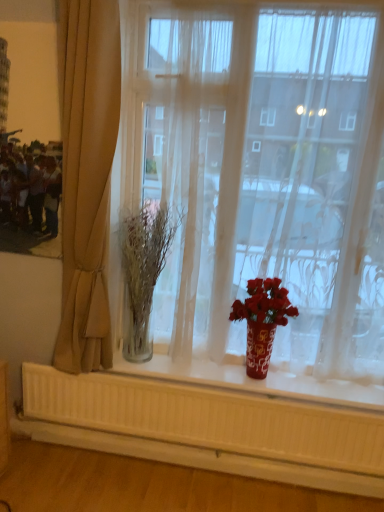
What do you see at coordinates (262, 321) in the screenshot?
I see `shiny red vase at center` at bounding box center [262, 321].

The width and height of the screenshot is (384, 512). Describe the element at coordinates (87, 176) in the screenshot. I see `beige fabric curtain at left` at that location.

I want to click on shiny red vase at center, so tap(262, 321).

Which is closer to the camera, (86,110) or (262,291)?

Point (86,110)

In terms of height, does beige fabric curtain at left look taller or shorter compared to shiny red vase at center?

In the image, beige fabric curtain at left appears to be taller than shiny red vase at center.

Find the location of a particular element. This screenshot has width=384, height=512. houseplant behind the beige fabric curtain at left is located at coordinates (262, 321).

Is transparent glass vase at center closer to the viewer compared to shiny red vase at center?

Yes, it is in front of shiny red vase at center.

Which is more to the right, transparent glass vase at center or shiny red vase at center?

transparent glass vase at center.

From the picture: Is transparent glass vase at center positioned with its back to shiny red vase at center?

Yes, transparent glass vase at center is positioned with its back facing shiny red vase at center.

Find the location of a particular element. This screenshot has width=384, height=512. window above the shiny red vase at center (from the image's perspective) is located at coordinates coord(261,186).

Is clear glass vase at center taller than shiny red vase at center?

Correct, clear glass vase at center is much taller as shiny red vase at center.

Based on the photo, is clear glass vase at center surrounding shiny red vase at center?

No, shiny red vase at center is not surrounded by clear glass vase at center.

Is shiny red vase at center at the back of clear glass vase at center?

clear glass vase at center is not turned away from shiny red vase at center.

Based on the photo, is clear glass vase at center at the right side of shiny red vase at center?

No, clear glass vase at center is not to the right of shiny red vase at center.

Locate an element on the screen. The image size is (384, 512). curtain in front of the clear glass vase at center is located at coordinates (87, 176).

Considering the sizes of beige fabric curtain at left and clear glass vase at center in the image, is beige fabric curtain at left bigger or smaller than clear glass vase at center?

Considering their sizes, beige fabric curtain at left takes up more space than clear glass vase at center.

From the image's perspective, between beige fabric curtain at left and clear glass vase at center, which one is located above?

beige fabric curtain at left.

Does point (97, 38) come behind point (161, 223)?

No, it is in front of (161, 223).

Is transparent glass vase at center closer to the viewer compared to beige fabric curtain at left?

No, it is not.

Find the location of `curtain that appears in front of the transparent glass vase at center`. curtain that appears in front of the transparent glass vase at center is located at coordinates (87, 176).

From the image's perspective, is transparent glass vase at center above or below beige fabric curtain at left?

Based on their image positions, transparent glass vase at center is located above beige fabric curtain at left.

Can you confirm if transparent glass vase at center is wider than beige fabric curtain at left?

No, transparent glass vase at center is not wider than beige fabric curtain at left.

Considering the relative sizes of shiny red vase at center and clear glass vase at center in the image provided, is shiny red vase at center thinner than clear glass vase at center?

Indeed, shiny red vase at center has a lesser width compared to clear glass vase at center.

Is shiny red vase at center facing away from clear glass vase at center?

shiny red vase at center does not have its back to clear glass vase at center.

Considering the positions of objects shiny red vase at center and clear glass vase at center in the image provided, who is behind, shiny red vase at center or clear glass vase at center?

clear glass vase at center.

Considering the points (250, 310) and (122, 246), which point is behind, point (250, 310) or point (122, 246)?

The point (122, 246) is more distant.

Is shiny red vase at center positioned far away from beige fabric curtain at left?

No.

Which is in front, point (247, 373) or point (92, 32)?

The point (92, 32) is closer to the camera.

Which of these two, shiny red vase at center or beige fabric curtain at left, is smaller?

Smaller between the two is shiny red vase at center.

Locate an element on the screen. The width and height of the screenshot is (384, 512). curtain above the shiny red vase at center (from a real-world perspective) is located at coordinates (87, 176).

At what (x,y) coordinates should I click in order to perform the action: click on window lying on the right of shiny red vase at center. Please return your answer as a coordinate pair (x, y). Image resolution: width=384 pixels, height=512 pixels. Looking at the image, I should click on (261, 186).

When comparing their distances from transparent glass vase at center, does shiny red vase at center or beige fabric curtain at left seem further?

beige fabric curtain at left.

Which object lies nearer to the anchor point beige fabric curtain at left, transparent glass vase at center or shiny red vase at center?

Among the two, transparent glass vase at center is located nearer to beige fabric curtain at left.

Considering their positions, is clear glass vase at center positioned closer to beige fabric curtain at left than transparent glass vase at center?

The object closer to beige fabric curtain at left is clear glass vase at center.

In the scene shown: Which object lies nearer to the anchor point transparent glass vase at center, beige fabric curtain at left or clear glass vase at center?

The object closer to transparent glass vase at center is clear glass vase at center.

In the scene shown: Looking at the image, which one is located further to shiny red vase at center, transparent glass vase at center or clear glass vase at center?

clear glass vase at center lies further to shiny red vase at center than the other object.

From the image, which object appears to be nearer to transparent glass vase at center, clear glass vase at center or beige fabric curtain at left?

clear glass vase at center is closer to transparent glass vase at center.

Considering their positions, is clear glass vase at center positioned further to transparent glass vase at center than shiny red vase at center?

shiny red vase at center.

Based on their spatial positions, is transparent glass vase at center or clear glass vase at center further from beige fabric curtain at left?

transparent glass vase at center is positioned further to the anchor beige fabric curtain at left.

Find the location of a particular element. plant between beige fabric curtain at left and shiny red vase at center in the horizontal direction is located at coordinates (144, 272).

Identify the location of houseplant between beige fabric curtain at left and transparent glass vase at center in the horizontal direction. The height and width of the screenshot is (512, 384). (262, 321).

Locate an element on the screen. plant between beige fabric curtain at left and transparent glass vase at center is located at coordinates (144, 272).

Where is `houseplant between clear glass vase at center and transparent glass vase at center`? The height and width of the screenshot is (512, 384). houseplant between clear glass vase at center and transparent glass vase at center is located at coordinates (262, 321).